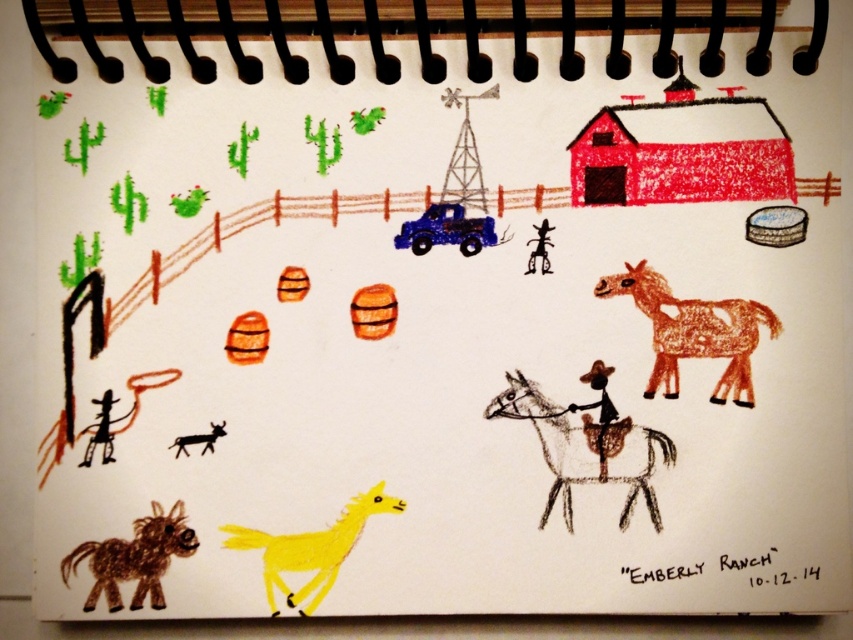
Is point (705, 316) farther from viewer compared to point (509, 400)?

Yes, point (705, 316) is behind point (509, 400).

Is brown textured horse at lower right to the left of brown textured horse at center from the viewer's perspective?

No, brown textured horse at lower right is not to the left of brown textured horse at center.

Locate an element on the screen. Image resolution: width=853 pixels, height=640 pixels. brown textured horse at lower right is located at coordinates (693, 332).

Does yellow matte horse at lower left have a greater width compared to brown scribbled horse at lower left?

Indeed, yellow matte horse at lower left has a greater width compared to brown scribbled horse at lower left.

Is point (230, 528) positioned behind point (155, 502)?

That is False.

I want to click on yellow matte horse at lower left, so click(311, 548).

Between point (751, 300) and point (363, 508), which one is positioned in front?

Point (363, 508)

Does brown textured horse at lower right have a larger size compared to yellow matte horse at lower left?

Yes.

Measure the distance between point (737, 397) and camera.

Point (737, 397) and camera are 31.57 inches apart from each other.

What are the coordinates of `brown textured horse at lower right` in the screenshot? It's located at (693, 332).